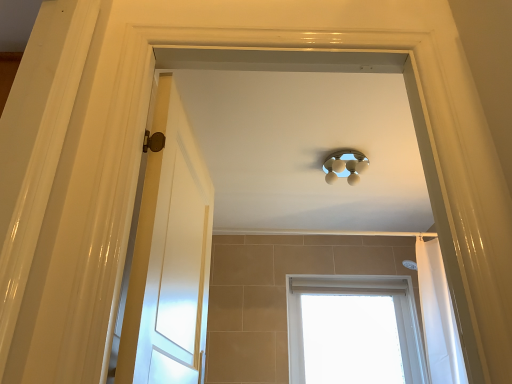
Question: From the image's perspective, is white fabric shower curtain at right located above white wooden door at left?

Choices:
 (A) no
 (B) yes

Answer: (A)

Question: Is white fabric shower curtain at right positioned far away from white wooden door at left?

Choices:
 (A) yes
 (B) no

Answer: (A)

Question: From a real-world perspective, is white fabric shower curtain at right below white wooden door at left?

Choices:
 (A) no
 (B) yes

Answer: (A)

Question: Is white fabric shower curtain at right at the left side of white wooden door at left?

Choices:
 (A) yes
 (B) no

Answer: (B)

Question: Is white fabric shower curtain at right not inside white wooden door at left?

Choices:
 (A) yes
 (B) no

Answer: (A)

Question: In terms of height, does white wooden door at left look taller or shorter compared to white plastic window at lower center?

Choices:
 (A) tall
 (B) short

Answer: (A)

Question: Based on their sizes in the image, would you say white wooden door at left is bigger or smaller than white plastic window at lower center?

Choices:
 (A) big
 (B) small

Answer: (B)

Question: Is white wooden door at left to the left or to the right of white plastic window at lower center in the image?

Choices:
 (A) right
 (B) left

Answer: (B)

Question: From the image's perspective, relative to white plastic window at lower center, is white wooden door at left above or below?

Choices:
 (A) below
 (B) above

Answer: (B)

Question: From a real-world perspective, is white fabric shower curtain at right physically located above or below white plastic window at lower center?

Choices:
 (A) below
 (B) above

Answer: (B)

Question: Is white fabric shower curtain at right wider or thinner than white plastic window at lower center?

Choices:
 (A) wide
 (B) thin

Answer: (A)

Question: In terms of size, does white fabric shower curtain at right appear bigger or smaller than white plastic window at lower center?

Choices:
 (A) big
 (B) small

Answer: (B)

Question: Is white fabric shower curtain at right in front of or behind white plastic window at lower center in the image?

Choices:
 (A) behind
 (B) front

Answer: (B)

Question: Would you say white wooden door at left is inside or outside white fabric shower curtain at right?

Choices:
 (A) outside
 (B) inside

Answer: (A)

Question: From the image's perspective, relative to white fabric shower curtain at right, is white wooden door at left above or below?

Choices:
 (A) below
 (B) above

Answer: (B)